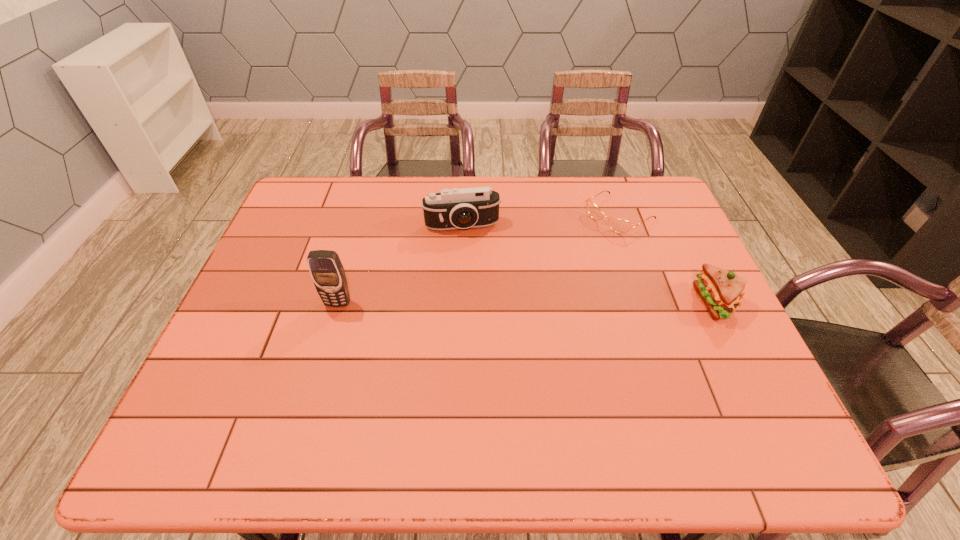
Find the location of a particular element. vacant space that's between the camera and the rightmost object is located at coordinates (588, 264).

The width and height of the screenshot is (960, 540). Identify the location of vacant point located between the sandwich and the third object from right to left. (588, 264).

Locate an element on the screen. This screenshot has height=540, width=960. free spot between the rightmost object and the tallest object is located at coordinates (527, 303).

At what (x,y) coordinates should I click in order to perform the action: click on object that can be found as the third closest to the rightmost object. Please return your answer as a coordinate pair (x, y). This screenshot has height=540, width=960. Looking at the image, I should click on point(327,272).

You are a GUI agent. You are given a task and a screenshot of the screen. Output one action in this format:
    pyautogui.click(x=<x>, y=<y>)
    Task: Click on the object that is the third nearest to the camera
    This screenshot has height=540, width=960.
    Given the screenshot: What is the action you would take?
    pyautogui.click(x=721, y=290)

At what (x,y) coordinates should I click in order to perform the action: click on vacant space that satisfies the following two spatial constraints: 1. on the front side of the rightmost object; 2. on the right side of the camera. Please return your answer as a coordinate pair (x, y). Looking at the image, I should click on (459, 303).

You are a GUI agent. You are given a task and a screenshot of the screen. Output one action in this format:
    pyautogui.click(x=<x>, y=<y>)
    Task: Click on the free space in the image that satisfies the following two spatial constraints: 1. on the front side of the sandwich; 2. on the right side of the second object from left to right
    This screenshot has height=540, width=960.
    Given the screenshot: What is the action you would take?
    pyautogui.click(x=459, y=303)